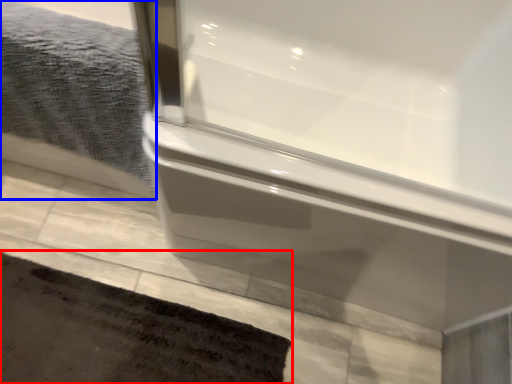
Question: Which object appears closest to the camera in this image, bath mat (highlighted by a red box) or bath towel (highlighted by a blue box)?

Choices:
 (A) bath mat
 (B) bath towel

Answer: (B)